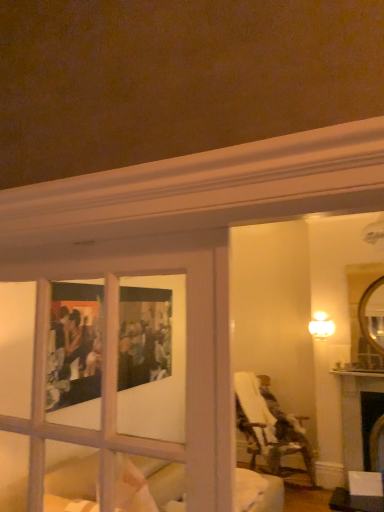
What is the approximate width of plaid fabric chair at right?

The width of plaid fabric chair at right is 35.31 inches.

Describe the element at coordinates (269, 426) in the screenshot. I see `plaid fabric chair at right` at that location.

What are the coordinates of `plaid fabric chair at right` in the screenshot? It's located at (269, 426).

Identify the location of white glossy light fixture at upper right. The height and width of the screenshot is (512, 384). click(x=321, y=326).

What do you see at coordinates (321, 326) in the screenshot? I see `white glossy light fixture at upper right` at bounding box center [321, 326].

The width and height of the screenshot is (384, 512). What are the coordinates of `plaid fabric chair at right` in the screenshot? It's located at (269, 426).

Between white glossy light fixture at upper right and plaid fabric chair at right, which one appears on the right side from the viewer's perspective?

white glossy light fixture at upper right.

Considering their positions, is white glossy light fixture at upper right located in front of or behind plaid fabric chair at right?

In the image, white glossy light fixture at upper right appears behind plaid fabric chair at right.

Which is farther from the camera, (325, 321) or (236, 425)?

The point (325, 321) is farther from the camera.

From the image's perspective, which object appears higher, white glossy light fixture at upper right or plaid fabric chair at right?

white glossy light fixture at upper right is shown above in the image.

From a real-world perspective, is white glossy light fixture at upper right below plaid fabric chair at right?

Actually, white glossy light fixture at upper right is physically above plaid fabric chair at right in the real world.

Between white glossy light fixture at upper right and plaid fabric chair at right, which one has larger width?

plaid fabric chair at right is wider.

Who is shorter, white glossy light fixture at upper right or plaid fabric chair at right?

With less height is white glossy light fixture at upper right.

Considering the sizes of white glossy light fixture at upper right and plaid fabric chair at right in the image, is white glossy light fixture at upper right bigger or smaller than plaid fabric chair at right?

Considering their sizes, white glossy light fixture at upper right takes up less space than plaid fabric chair at right.

Would you say plaid fabric chair at right is part of white glossy light fixture at upper right's contents?

No, plaid fabric chair at right is not a part of white glossy light fixture at upper right.

Is white glossy light fixture at upper right not near plaid fabric chair at right?

Yes, white glossy light fixture at upper right and plaid fabric chair at right are located far from each other.

Is white glossy light fixture at upper right facing away from plaid fabric chair at right?

No.

Can you tell me how much white glossy light fixture at upper right and plaid fabric chair at right differ in facing direction?

There is a 60.4-degree angle between the facing directions of white glossy light fixture at upper right and plaid fabric chair at right.

Measure the distance between white glossy light fixture at upper right and plaid fabric chair at right.

white glossy light fixture at upper right and plaid fabric chair at right are 3.45 feet apart.

In the image, there is a white glossy light fixture at upper right. Identify the location of chair below it (from a real-world perspective). Image resolution: width=384 pixels, height=512 pixels. (269, 426).

Is plaid fabric chair at right to the right of white glossy light fixture at upper right from the viewer's perspective?

No, plaid fabric chair at right is not to the right of white glossy light fixture at upper right.

Considering the positions of objects plaid fabric chair at right and white glossy light fixture at upper right in the image provided, who is in front, plaid fabric chair at right or white glossy light fixture at upper right?

Positioned in front is plaid fabric chair at right.

Which point is more forward, (x=307, y=465) or (x=331, y=334)?

The point (x=307, y=465) is in front.

From the image's perspective, who appears lower, plaid fabric chair at right or white glossy light fixture at upper right?

plaid fabric chair at right appears lower in the image.

From a real-world perspective, who is located higher, plaid fabric chair at right or white glossy light fixture at upper right?

From a 3D spatial view, white glossy light fixture at upper right is above.

Does plaid fabric chair at right have a greater width compared to white glossy light fixture at upper right?

Correct, the width of plaid fabric chair at right exceeds that of white glossy light fixture at upper right.

Considering the sizes of objects plaid fabric chair at right and white glossy light fixture at upper right in the image provided, who is shorter, plaid fabric chair at right or white glossy light fixture at upper right?

white glossy light fixture at upper right.

Considering the sizes of objects plaid fabric chair at right and white glossy light fixture at upper right in the image provided, who is smaller, plaid fabric chair at right or white glossy light fixture at upper right?

Smaller between the two is white glossy light fixture at upper right.

Would you say plaid fabric chair at right is inside or outside white glossy light fixture at upper right?

plaid fabric chair at right is outside white glossy light fixture at upper right.

Is plaid fabric chair at right in contact with white glossy light fixture at upper right?

No, plaid fabric chair at right is not in contact with white glossy light fixture at upper right.

Could you tell me if plaid fabric chair at right is facing white glossy light fixture at upper right?

No.

How many degrees apart are the facing directions of plaid fabric chair at right and white glossy light fixture at upper right?

They differ by 60.4 degrees in their facing directions.

Measure the distance between plaid fabric chair at right and white glossy light fixture at upper right.

plaid fabric chair at right and white glossy light fixture at upper right are 3.45 feet apart.

At what (x,y) coordinates should I click in order to perform the action: click on chair located below the white glossy light fixture at upper right (from the image's perspective). Please return your answer as a coordinate pair (x, y). This screenshot has height=512, width=384. Looking at the image, I should click on (269, 426).

This screenshot has width=384, height=512. I want to click on chair in front of the white glossy light fixture at upper right, so click(x=269, y=426).

Image resolution: width=384 pixels, height=512 pixels. Identify the location of light fixture that appears above the plaid fabric chair at right (from a real-world perspective). (321, 326).